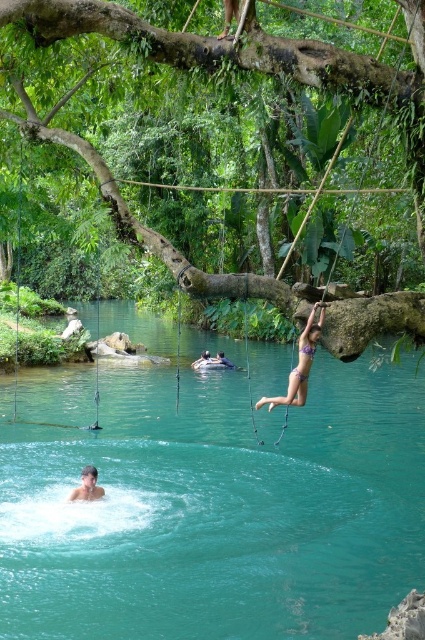
Does teal glossy water at center appear under purple bikini at center?

Yes.

Who is positioned more to the left, teal glossy water at center or purple bikini at center?

teal glossy water at center

Between point (150, 515) and point (303, 376), which one is positioned behind?

The point (150, 515) is more distant.

What are the coordinates of `teal glossy water at center` in the screenshot? It's located at (218, 509).

Can you confirm if smooth skin face at lower left is bigger than light blue fabric at center?

No.

Is point (73, 492) positioned after point (206, 356)?

No, (73, 492) is closer to viewer.

At what (x,y) coordinates should I click in order to perform the action: click on smooth skin face at lower left. Please return your answer as a coordinate pair (x, y). The width and height of the screenshot is (425, 640). Looking at the image, I should click on (87, 486).

Is point (334, 499) farther from viewer compared to point (90, 481)?

Yes.

Between teal glossy water at center and smooth skin face at lower left, which one is positioned higher?

teal glossy water at center is above.

Between point (155, 572) and point (85, 472), which one is positioned in front?

Point (155, 572)

Identify the location of teal glossy water at center. The image size is (425, 640). (218, 509).